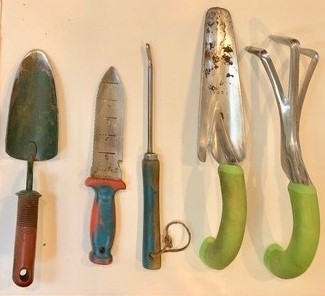
You are a GUI agent. You are given a task and a screenshot of the screen. Output one action in this format:
    pyautogui.click(x=<x>, y=<y>)
    Task: Click on the handle
    The width and height of the screenshot is (325, 296).
    Given the screenshot: What is the action you would take?
    pyautogui.click(x=29, y=242)